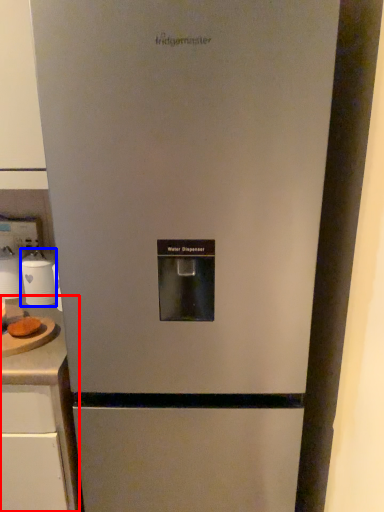
Question: Which object appears farthest to the camera in this image, counter top (highlighted by a red box) or appliance (highlighted by a blue box)?

Choices:
 (A) counter top
 (B) appliance

Answer: (B)